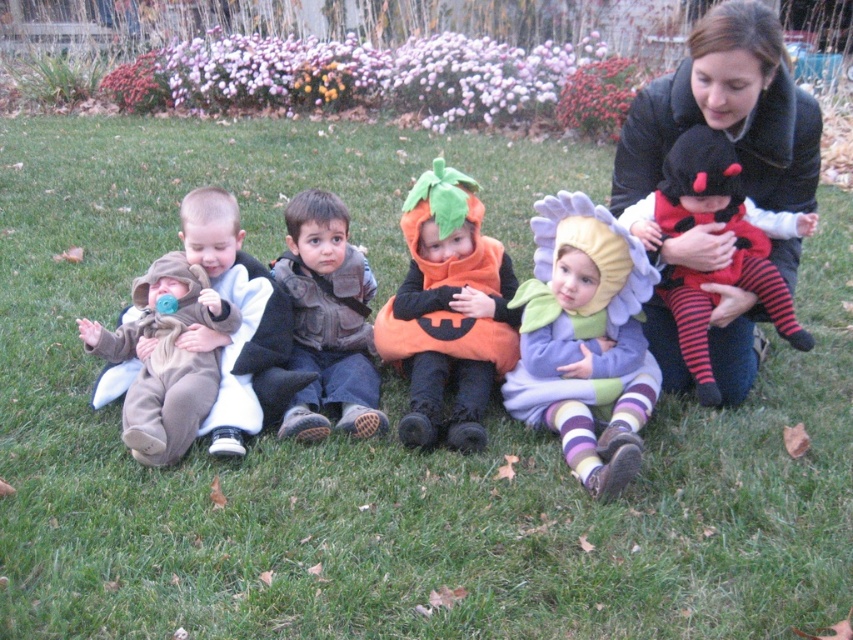
Can you confirm if black fuzzy coat at upper right is wider than purple fabric flower at center?

Correct, the width of black fuzzy coat at upper right exceeds that of purple fabric flower at center.

Looking at this image, is black fuzzy coat at upper right to the right of purple fabric flower at center from the viewer's perspective?

Indeed, black fuzzy coat at upper right is positioned on the right side of purple fabric flower at center.

Between point (763, 186) and point (614, 291), which one is positioned behind?

The point (614, 291) is behind.

Identify the location of black fuzzy coat at upper right. click(x=727, y=112).

Does orange fabric pumpkin at center appear over brown suede vest at center?

Yes, orange fabric pumpkin at center is above brown suede vest at center.

Is orange fabric pumpkin at center thinner than brown suede vest at center?

No, orange fabric pumpkin at center is not thinner than brown suede vest at center.

Does point (467, 317) come farther from viewer compared to point (346, 326)?

No.

At what (x,y) coordinates should I click in order to perform the action: click on orange fabric pumpkin at center. Please return your answer as a coordinate pair (x, y). Image resolution: width=853 pixels, height=640 pixels. Looking at the image, I should click on [448, 310].

Does black fuzzy coat at upper right have a greater height compared to orange fabric pumpkin at center?

Correct, black fuzzy coat at upper right is much taller as orange fabric pumpkin at center.

Does black fuzzy coat at upper right have a smaller size compared to orange fabric pumpkin at center?

Actually, black fuzzy coat at upper right might be larger than orange fabric pumpkin at center.

Describe the element at coordinates (727, 112) in the screenshot. I see `black fuzzy coat at upper right` at that location.

What are the coordinates of `black fuzzy coat at upper right` in the screenshot? It's located at (727, 112).